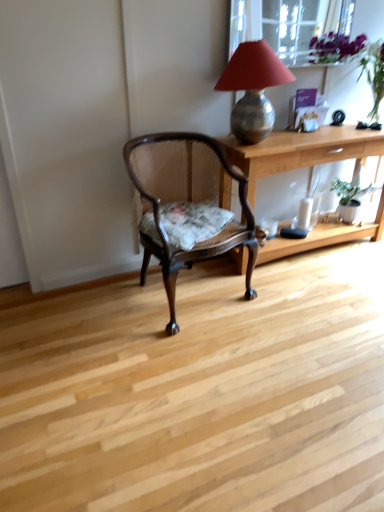
What are the coordinates of `free spot below mahogany cane chair at center (from a real-world perspective)` in the screenshot? It's located at (188, 293).